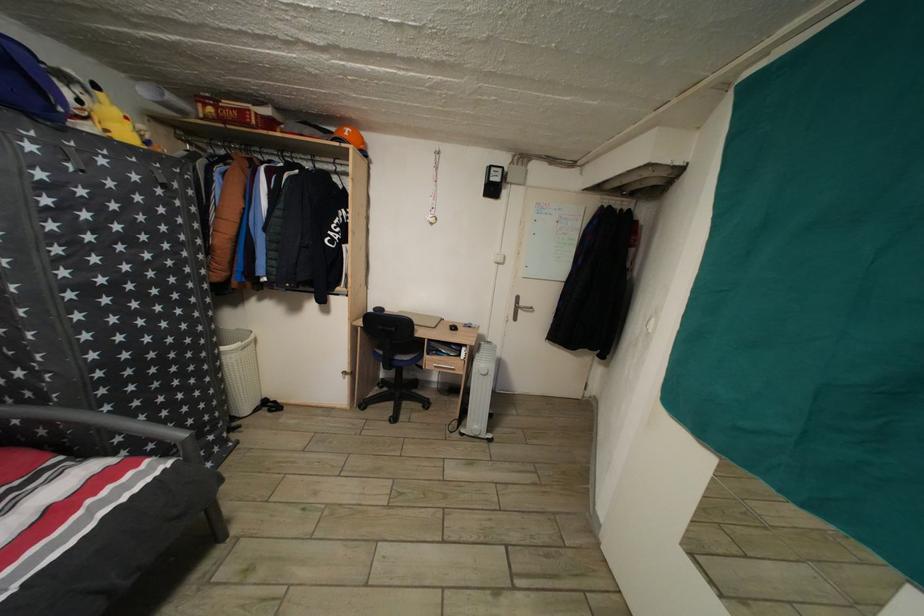
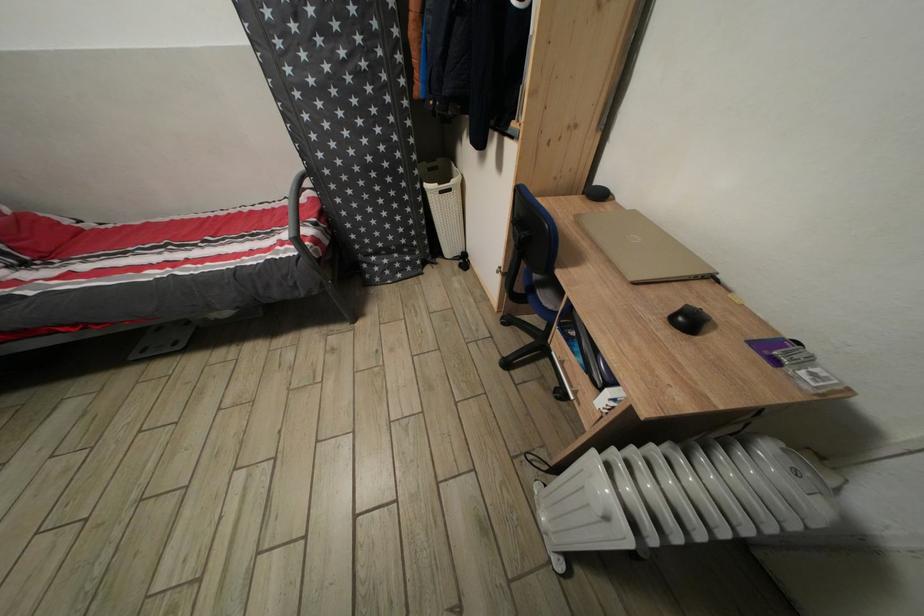
Find the pixel in the second image that matches (460,334) in the first image.

(696, 328)